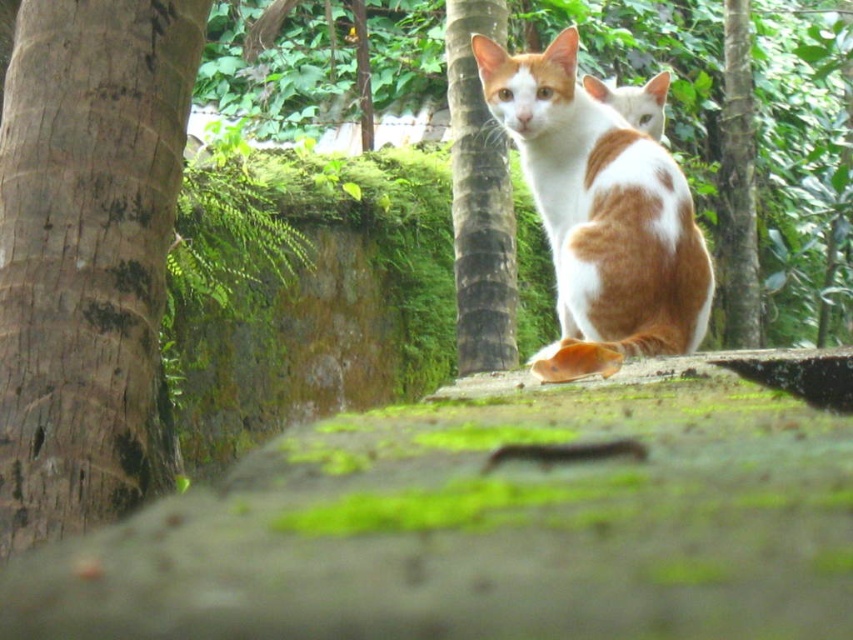
Who is higher up, green mossy tree trunk at center or orange and white fur cat at center?

green mossy tree trunk at center is higher up.

You are a GUI agent. You are given a task and a screenshot of the screen. Output one action in this format:
    pyautogui.click(x=<x>, y=<y>)
    Task: Click on the green mossy tree trunk at center
    
    Given the screenshot: What is the action you would take?
    pyautogui.click(x=737, y=186)

Where is `green mossy tree trunk at center`? green mossy tree trunk at center is located at coordinates (737, 186).

Does brown textured bark at left have a greater height compared to brown textured tree trunk at center?

No, brown textured bark at left is not taller than brown textured tree trunk at center.

Is brown textured bark at left bigger than brown textured tree trunk at center?

Yes, brown textured bark at left is bigger than brown textured tree trunk at center.

Locate an element on the screen. This screenshot has height=640, width=853. brown textured bark at left is located at coordinates (86, 256).

Find the location of a particular element. This screenshot has width=853, height=640. brown textured bark at left is located at coordinates (86, 256).

Can you confirm if brown textured bark at left is positioned to the left of green mossy tree trunk at center?

Yes, brown textured bark at left is to the left of green mossy tree trunk at center.

Find the location of a particular element. The height and width of the screenshot is (640, 853). brown textured bark at left is located at coordinates (86, 256).